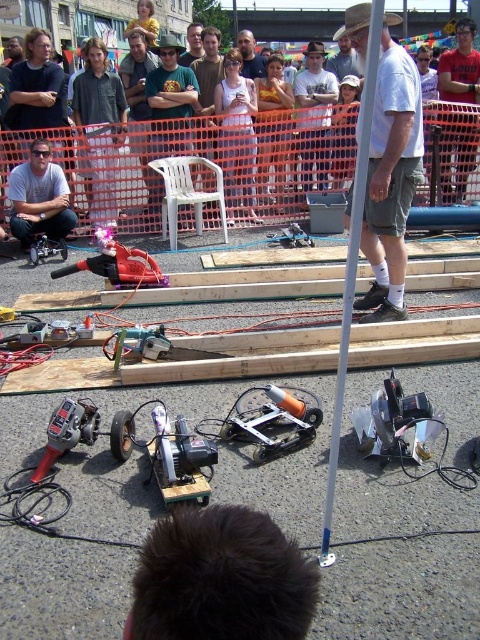
You are standing at the starting line of the miniature vehicle race track. You want to reach the finish line, which is located at point (331, 483). However, there is an obstacle at point (384, 280). Can you go around the obstacle to reach the finish line?

Yes, you can go around the obstacle at point (384, 280) to reach the finish line at point (331, 483) because the obstacle is behind the finish line, so you can pass by it on either side.

You are standing at the starting line of the miniature vehicle race track and want to place a flag at the closest point to you between point [13,134] and point [13,193]. Which point should you choose?

Point [13,134] is further to the viewer than point [13,193], so you should place the flag at point [13,134] as it is closer to you.